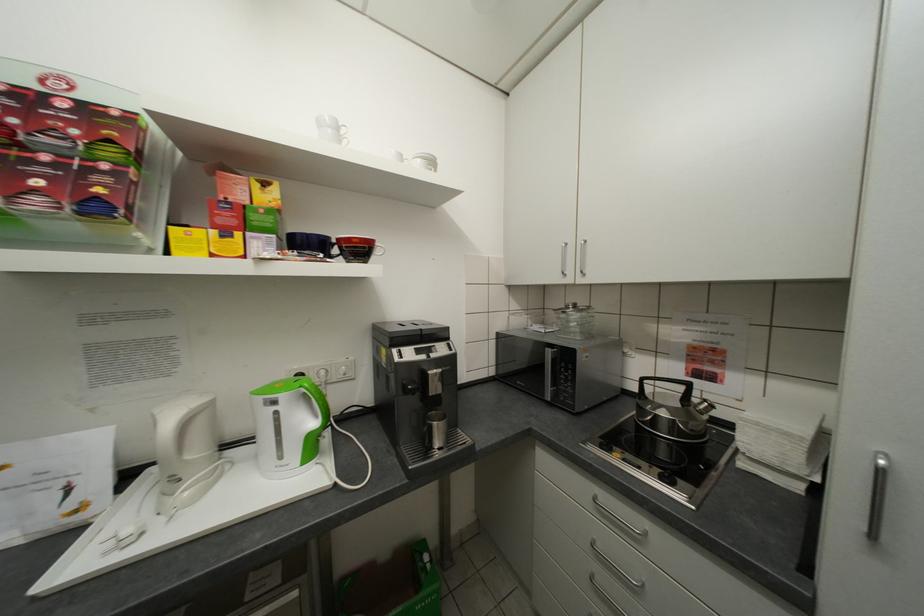
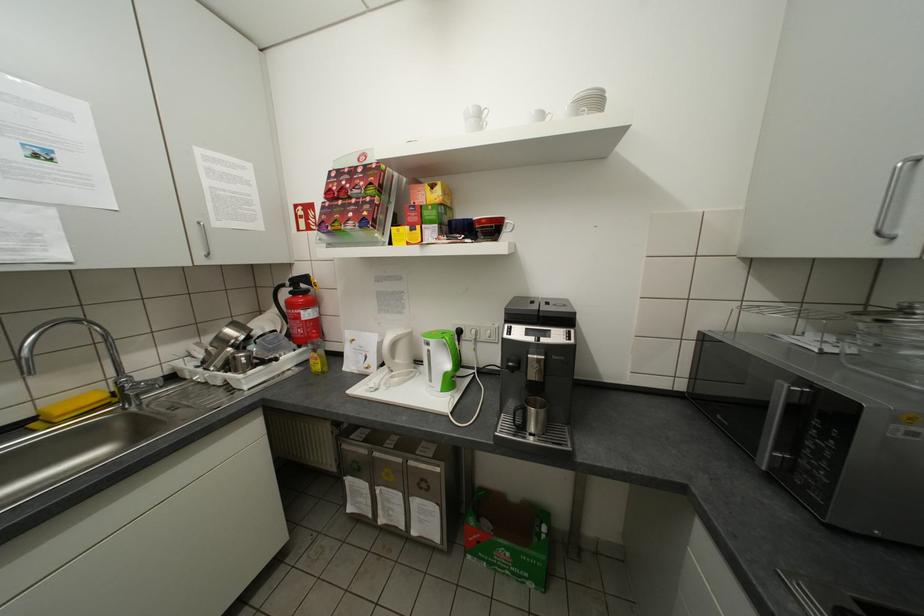
Locate, in the second image, the point that corresponds to (572,273) in the first image.

(888, 233)